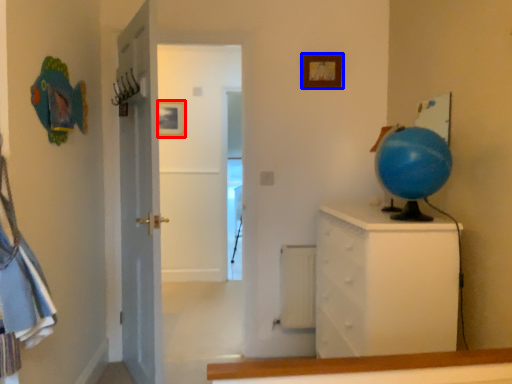
Question: Which of the following is the closest to the observer, picture frame (highlighted by a red box) or picture frame (highlighted by a blue box)?

Choices:
 (A) picture frame
 (B) picture frame

Answer: (B)